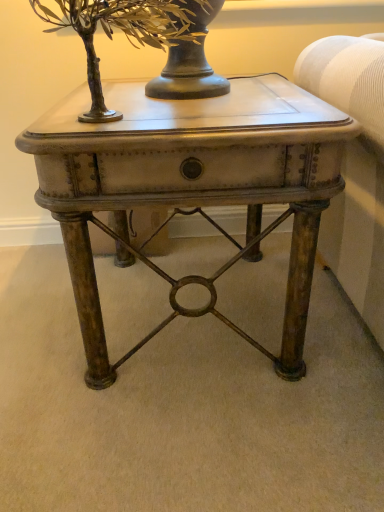
This screenshot has width=384, height=512. Describe the element at coordinates (190, 186) in the screenshot. I see `matte brown side table at center` at that location.

You are a GUI agent. You are given a task and a screenshot of the screen. Output one action in this format:
    pyautogui.click(x=<x>, y=<y>)
    Task: Click on the matte brown side table at center
    The image size is (384, 512).
    Given the screenshot: What is the action you would take?
    pyautogui.click(x=190, y=186)

The image size is (384, 512). Find the location of `green metallic tree at upper center`. green metallic tree at upper center is located at coordinates (129, 32).

This screenshot has width=384, height=512. Describe the element at coordinates (129, 32) in the screenshot. I see `green metallic tree at upper center` at that location.

Find the location of a particular element. The width and height of the screenshot is (384, 512). matte brown side table at center is located at coordinates (190, 186).

Can you confirm if green metallic tree at upper center is positioned to the left of matte brown side table at center?

Yes.

Looking at this image, between green metallic tree at upper center and matte brown side table at center, which one is positioned in front?

green metallic tree at upper center.

In the scene shown: Which point is more distant from viewer, (155,31) or (273,127)?

Point (155,31)

In the scene shown: From the image's perspective, which one is positioned lower, green metallic tree at upper center or matte brown side table at center?

matte brown side table at center is shown below in the image.

From a real-world perspective, is green metallic tree at upper center physically below matte brown side table at center?

No, from a real-world perspective, green metallic tree at upper center is not beneath matte brown side table at center.

Considering the relative sizes of green metallic tree at upper center and matte brown side table at center in the image provided, is green metallic tree at upper center wider than matte brown side table at center?

Incorrect, the width of green metallic tree at upper center does not surpass that of matte brown side table at center.

Considering the sizes of objects green metallic tree at upper center and matte brown side table at center in the image provided, who is taller, green metallic tree at upper center or matte brown side table at center?

With more height is matte brown side table at center.

Considering the sizes of objects green metallic tree at upper center and matte brown side table at center in the image provided, who is smaller, green metallic tree at upper center or matte brown side table at center?

green metallic tree at upper center.

Do you think green metallic tree at upper center is within matte brown side table at center, or outside of it?

green metallic tree at upper center cannot be found inside matte brown side table at center.

Would you consider green metallic tree at upper center to be distant from matte brown side table at center?

No, green metallic tree at upper center is in close proximity to matte brown side table at center.

Is green metallic tree at upper center facing away from matte brown side table at center?

No, matte brown side table at center is not at the back of green metallic tree at upper center.

Consider the image. How many degrees apart are the facing directions of green metallic tree at upper center and matte brown side table at center?

There is a 0.000774-degree angle between the facing directions of green metallic tree at upper center and matte brown side table at center.

The height and width of the screenshot is (512, 384). What are the coordinates of `tree on the left of matte brown side table at center` in the screenshot? It's located at (129, 32).

Does matte brown side table at center appear on the right side of green metallic tree at upper center?

Yes.

Which object is further away from the camera taking this photo, matte brown side table at center or green metallic tree at upper center?

matte brown side table at center.

Between point (35, 140) and point (95, 120), which one is positioned behind?

The point (95, 120) is farther.

From the image's perspective, between matte brown side table at center and green metallic tree at upper center, which one is located above?

From the image's view, green metallic tree at upper center is above.

From a real-world perspective, is matte brown side table at center positioned over green metallic tree at upper center based on gravity?

No.

Is matte brown side table at center wider or thinner than green metallic tree at upper center?

Clearly, matte brown side table at center has more width compared to green metallic tree at upper center.

Which of these two, matte brown side table at center or green metallic tree at upper center, stands taller?

With more height is matte brown side table at center.

Based on their sizes in the image, would you say matte brown side table at center is bigger or smaller than green metallic tree at upper center?

Clearly, matte brown side table at center is larger in size than green metallic tree at upper center.

Can we say matte brown side table at center lies outside green metallic tree at upper center?

Absolutely, matte brown side table at center is external to green metallic tree at upper center.

Are matte brown side table at center and green metallic tree at upper center beside each other?

No, matte brown side table at center is not beside green metallic tree at upper center.

Consider the image. Could you tell me if matte brown side table at center is facing green metallic tree at upper center?

No.

What's the angular difference between matte brown side table at center and green metallic tree at upper center's facing directions?

There is a 0.000774-degree angle between the facing directions of matte brown side table at center and green metallic tree at upper center.

Measure the distance between matte brown side table at center and green metallic tree at upper center.

matte brown side table at center and green metallic tree at upper center are 8.90 inches apart.

What are the coordinates of `table on the right side of green metallic tree at upper center` in the screenshot? It's located at click(190, 186).

Image resolution: width=384 pixels, height=512 pixels. I want to click on table below the green metallic tree at upper center (from the image's perspective), so click(x=190, y=186).

I want to click on tree lying above the matte brown side table at center (from the image's perspective), so click(x=129, y=32).